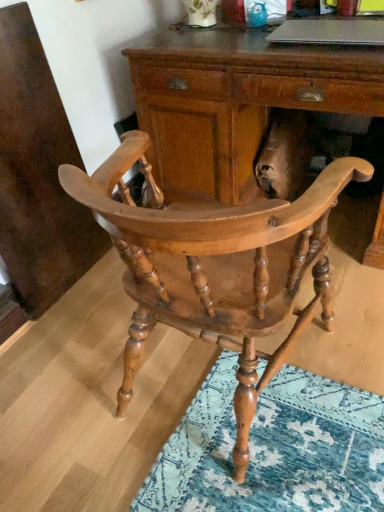
Question: Is wooden desk at center closer to camera compared to natural wood chair at center?

Choices:
 (A) yes
 (B) no

Answer: (B)

Question: From a real-world perspective, is wooden desk at center physically above natural wood chair at center?

Choices:
 (A) no
 (B) yes

Answer: (A)

Question: Considering the relative positions of wooden desk at center and natural wood chair at center in the image provided, is wooden desk at center to the left of natural wood chair at center from the viewer's perspective?

Choices:
 (A) no
 (B) yes

Answer: (A)

Question: Is wooden desk at center positioned behind natural wood chair at center?

Choices:
 (A) no
 (B) yes

Answer: (B)

Question: From the image's perspective, is wooden desk at center below natural wood chair at center?

Choices:
 (A) no
 (B) yes

Answer: (A)

Question: Would you say silver metallic laptop at upper center is inside or outside natural wood chair at center?

Choices:
 (A) outside
 (B) inside

Answer: (A)

Question: From a real-world perspective, relative to natural wood chair at center, is silver metallic laptop at upper center vertically above or below?

Choices:
 (A) below
 (B) above

Answer: (B)

Question: Is point (372, 34) positioned closer to the camera than point (84, 180)?

Choices:
 (A) closer
 (B) farther

Answer: (B)

Question: Is silver metallic laptop at upper center taller or shorter than natural wood chair at center?

Choices:
 (A) tall
 (B) short

Answer: (B)

Question: Is wooden desk at center in front of or behind silver metallic laptop at upper center in the image?

Choices:
 (A) behind
 (B) front

Answer: (B)

Question: Is point (160, 65) positioned closer to the camera than point (322, 37)?

Choices:
 (A) farther
 (B) closer

Answer: (A)

Question: From the image's perspective, is wooden desk at center located above or below silver metallic laptop at upper center?

Choices:
 (A) above
 (B) below

Answer: (B)

Question: Is wooden desk at center spatially inside silver metallic laptop at upper center, or outside of it?

Choices:
 (A) outside
 (B) inside

Answer: (A)

Question: Is point (360, 252) positioned closer to the camera than point (213, 338)?

Choices:
 (A) farther
 (B) closer

Answer: (A)

Question: Do you think wooden desk at center is within natural wood chair at center, or outside of it?

Choices:
 (A) outside
 (B) inside

Answer: (A)